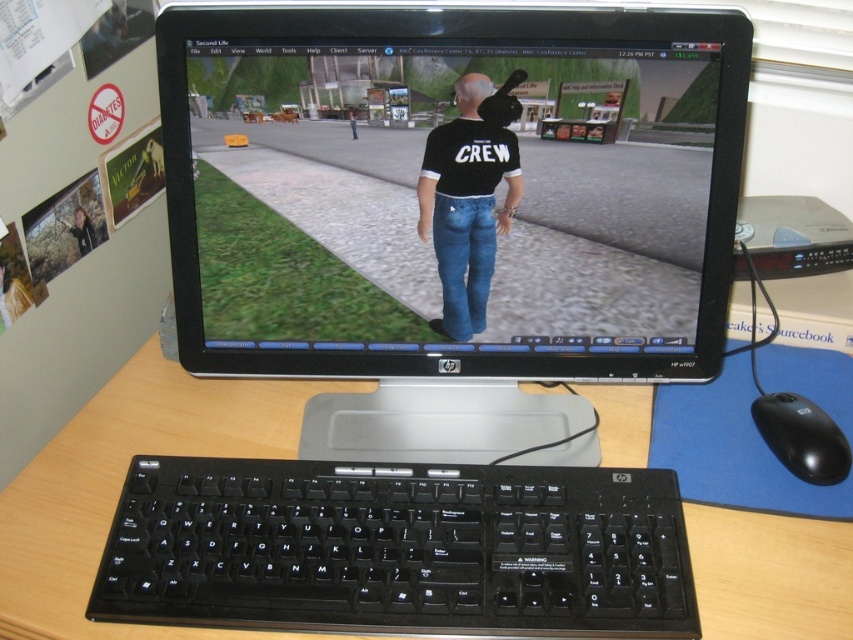
Question: Which point is closer to the camera taking this photo?

Choices:
 (A) pos(239,580)
 (B) pos(850,452)

Answer: (A)

Question: Can you confirm if black plastic keyboard at lower center is wider than black matte shirt at center?

Choices:
 (A) no
 (B) yes

Answer: (B)

Question: In this image, where is black plastic monitor at center located relative to black plastic keyboard at lower center?

Choices:
 (A) below
 (B) above

Answer: (B)

Question: Which point appears closest to the camera in this image?

Choices:
 (A) [811, 413]
 (B) [489, 125]

Answer: (B)

Question: Which point is closer to the camera taking this photo?

Choices:
 (A) (386, 566)
 (B) (213, 72)
 (C) (844, 436)
 (D) (463, 154)

Answer: (A)

Question: Is black matte shirt at center smaller than black plastic mouse at lower right?

Choices:
 (A) no
 (B) yes

Answer: (A)